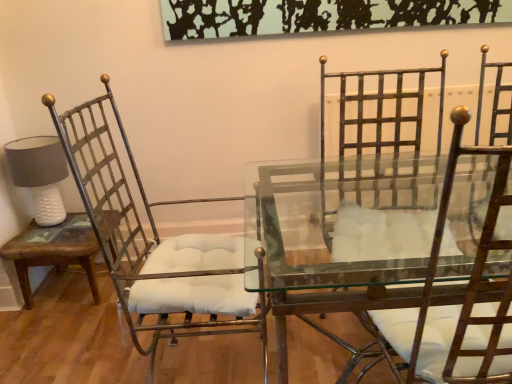
Question: Are metallic white cushioned chair at left, placed as the 1th chair when sorted from left to right, and brown wood side table at left far apart?

Choices:
 (A) no
 (B) yes

Answer: (A)

Question: Is brown wood side table at left inside metallic white cushioned chair at left, the 2th chair from the right?

Choices:
 (A) no
 (B) yes

Answer: (A)

Question: Does metallic white cushioned chair at left, the 2th chair from the right, come behind brown wood side table at left?

Choices:
 (A) yes
 (B) no

Answer: (B)

Question: Is metallic white cushioned chair at left, placed as the 1th chair when sorted from left to right, wider than brown wood side table at left?

Choices:
 (A) yes
 (B) no

Answer: (A)

Question: Can you confirm if metallic white cushioned chair at left, the 2th chair from the right, is positioned to the left of brown wood side table at left?

Choices:
 (A) no
 (B) yes

Answer: (A)

Question: Considering the positions of metallic iron chair at right, arranged as the first chair when viewed from the right, and brown wood side table at left in the image, is metallic iron chair at right, arranged as the first chair when viewed from the right, bigger or smaller than brown wood side table at left?

Choices:
 (A) small
 (B) big

Answer: (B)

Question: Do you think metallic iron chair at right, arranged as the first chair when viewed from the right, is within brown wood side table at left, or outside of it?

Choices:
 (A) outside
 (B) inside

Answer: (A)

Question: Would you say metallic iron chair at right, the second chair when ordered from left to right, is to the left or to the right of brown wood side table at left in the picture?

Choices:
 (A) right
 (B) left

Answer: (A)

Question: Is metallic iron chair at right, arranged as the first chair when viewed from the right, taller or shorter than brown wood side table at left?

Choices:
 (A) tall
 (B) short

Answer: (A)

Question: Is clear glass table at center spatially inside metallic iron chair at right, the second chair when ordered from left to right, or outside of it?

Choices:
 (A) inside
 (B) outside

Answer: (B)

Question: Based on their positions, is clear glass table at center located to the left or right of metallic iron chair at right, the second chair when ordered from left to right?

Choices:
 (A) left
 (B) right

Answer: (A)

Question: Considering the positions of clear glass table at center and metallic iron chair at right, arranged as the first chair when viewed from the right, in the image, is clear glass table at center taller or shorter than metallic iron chair at right, arranged as the first chair when viewed from the right,?

Choices:
 (A) tall
 (B) short

Answer: (B)

Question: In the image, is clear glass table at center positioned in front of or behind metallic iron chair at right, the second chair when ordered from left to right?

Choices:
 (A) front
 (B) behind

Answer: (B)

Question: From the image's perspective, is white textured lampshade at left above or below clear glass table at center?

Choices:
 (A) below
 (B) above

Answer: (B)

Question: Considering the positions of white textured lampshade at left and clear glass table at center in the image, is white textured lampshade at left bigger or smaller than clear glass table at center?

Choices:
 (A) small
 (B) big

Answer: (A)